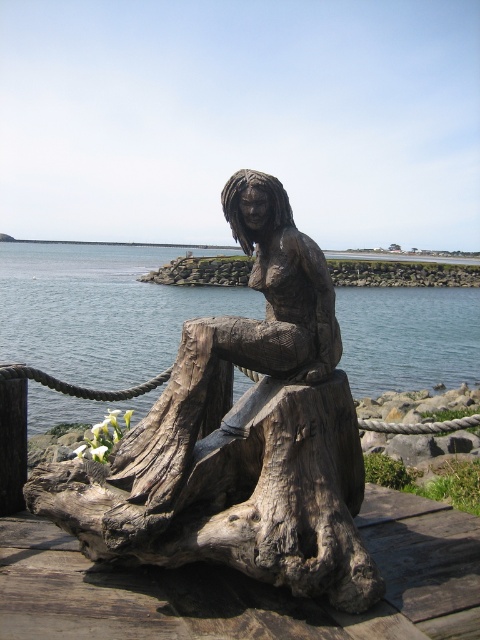
Between wooden statue at center and clear blue water at center, which one appears on the left side from the viewer's perspective?

wooden statue at center is more to the left.

Measure the distance between wooden statue at center and camera.

The distance of wooden statue at center from camera is 11.60 feet.

Is point (332, 440) behind point (474, 317)?

No, (332, 440) is closer to viewer.

You are a GUI agent. You are given a task and a screenshot of the screen. Output one action in this format:
    pyautogui.click(x=<x>, y=<y>)
    Task: Click on the wooden statue at center
    The height and width of the screenshot is (640, 480).
    Given the screenshot: What is the action you would take?
    pyautogui.click(x=240, y=436)